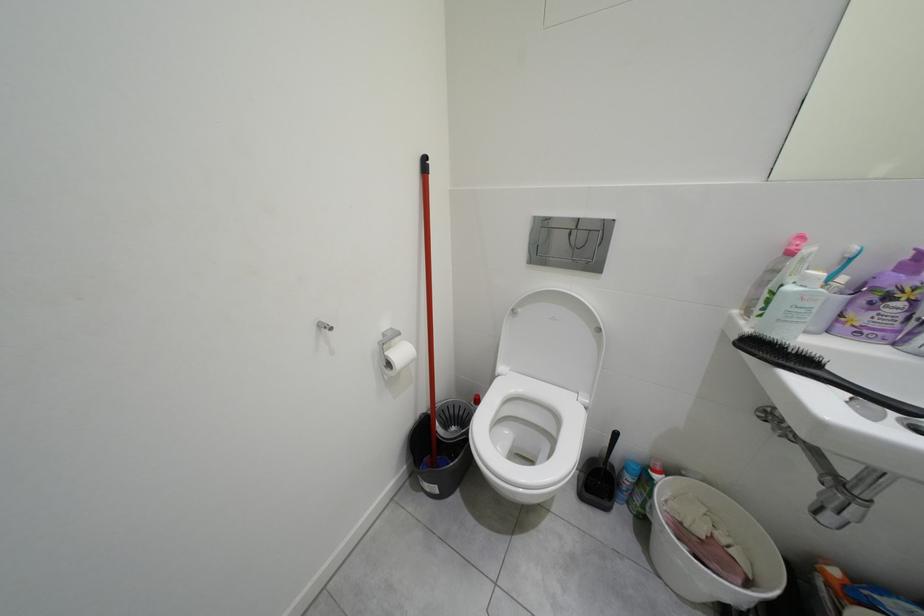
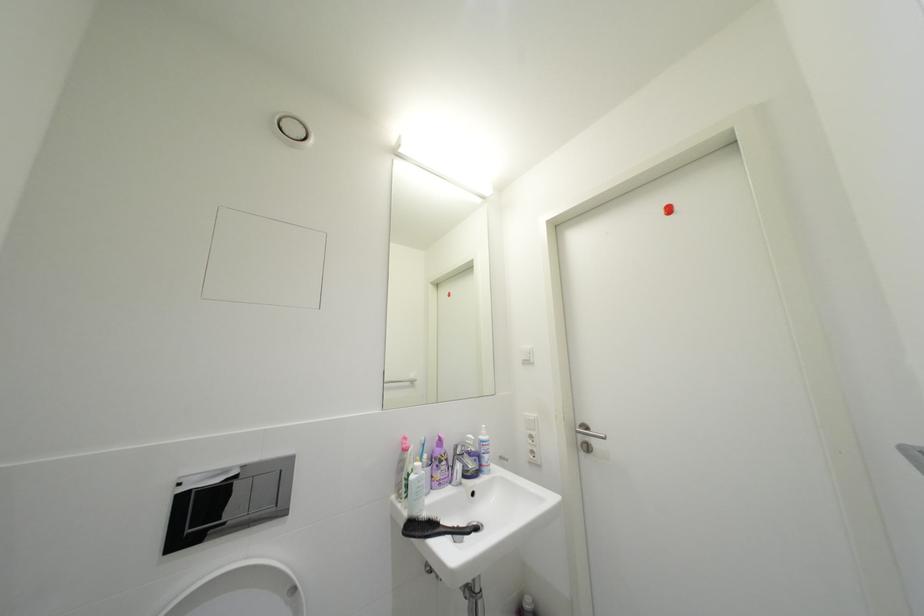
The first image is from the beginning of the video and the second image is from the end. How did the camera likely rotate when shooting the video?

The camera's rotation is toward right-up.